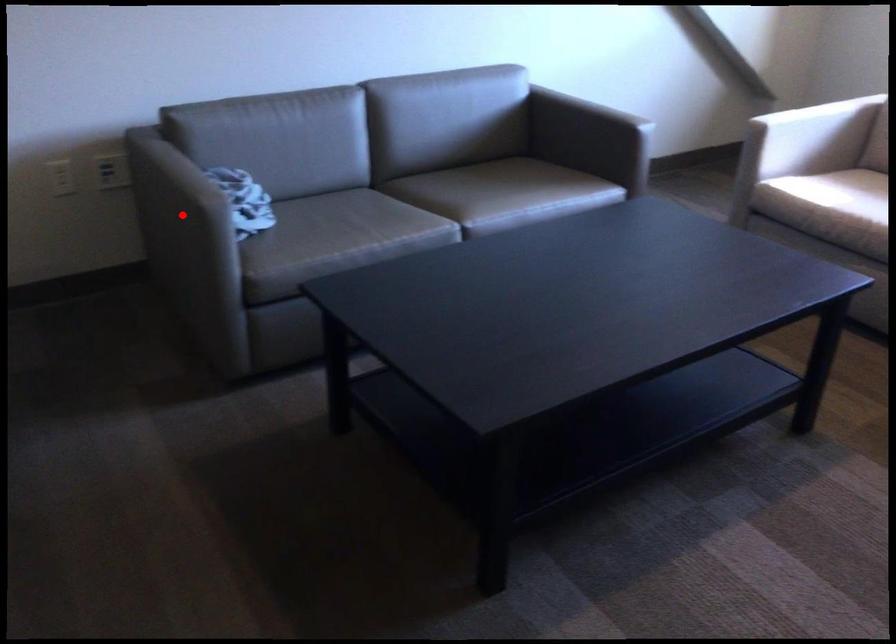
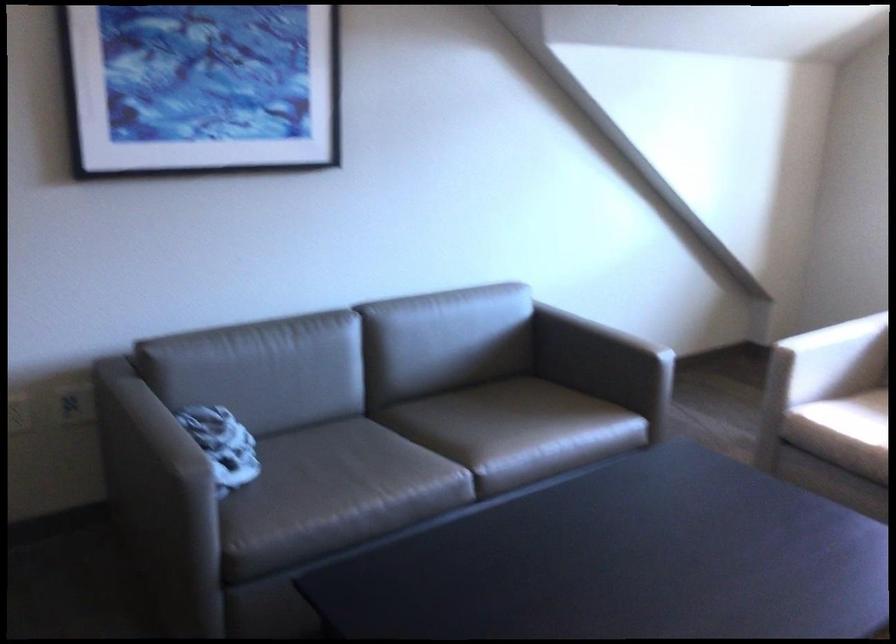
Question: I am providing you with two images of the same scene from different viewpoints. Image1 has a red point marked. In image2, the corresponding 3D location appears at what relative position? Reply with the corresponding letter.

Choices:
 (A) Closer
 (B) Farther

Answer: (A)